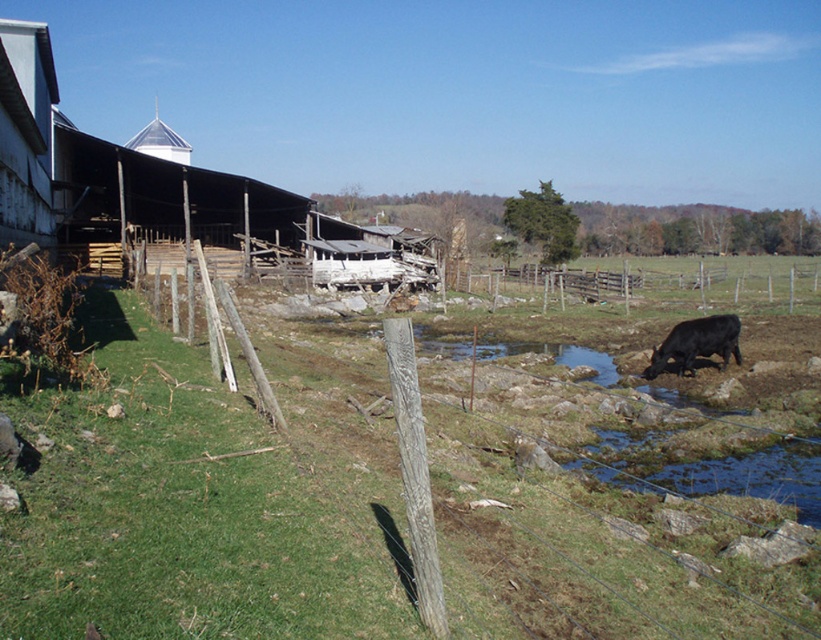
Is wooden fence at center-right bigger than black glossy cow at lower right?

Yes.

How far apart are wooden fence at center-right and black glossy cow at lower right?

wooden fence at center-right and black glossy cow at lower right are 115.69 feet apart.

What do you see at coordinates (643, 284) in the screenshot? This screenshot has width=821, height=640. I see `wooden fence at center-right` at bounding box center [643, 284].

Identify the location of wooden fence at center-right. This screenshot has height=640, width=821. (643, 284).